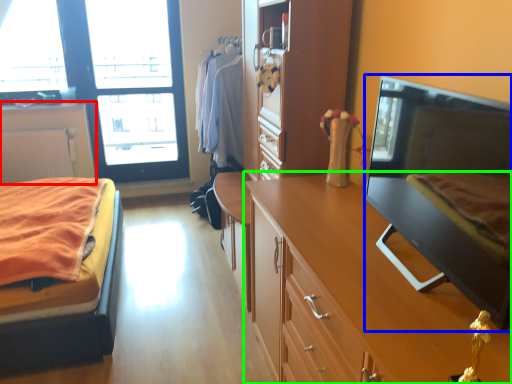
Question: Considering the real-world distances, which object is closest to cabinetry (highlighted by a red box)? flat (highlighted by a blue box) or cabinetry (highlighted by a green box).

Choices:
 (A) flat
 (B) cabinetry

Answer: (B)